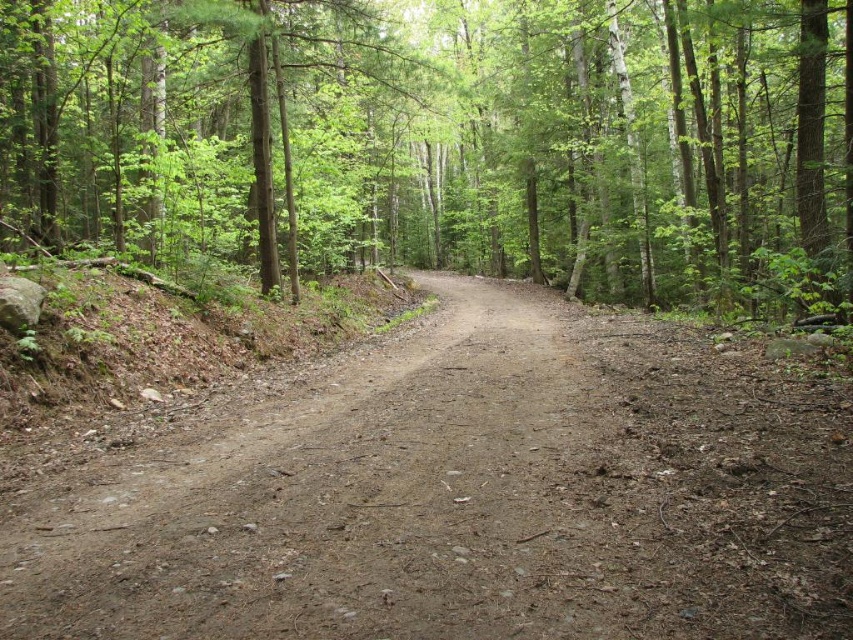
You are a hiker planning to walk along the dirt path in the forest. You have two options for the path you can take. One is the brown textured dirt path at center, and the other is the brown gravel path at center. Which path is wider?

The brown textured dirt path at center is bigger than brown gravel path at center, so the brown textured dirt path at center is wider.

You are a hiker carrying a heavy backpack and need to choose between the brown textured dirt path at center and the brown gravel path at center. Which path is closer to you?

The distance between the brown textured dirt path at center and the brown gravel path at center is 15.57 meters, so they are both equally distant from you since they are the same path.

You are a hiker carrying a heavy backpack and notice two paths in the forest. One is the brown textured dirt path at center and the other is the brown gravel path at center. Which path should you take if you want to walk on the upper layer?

You should take the brown textured dirt path at center because it is above the brown gravel path at center, making it the upper layer.